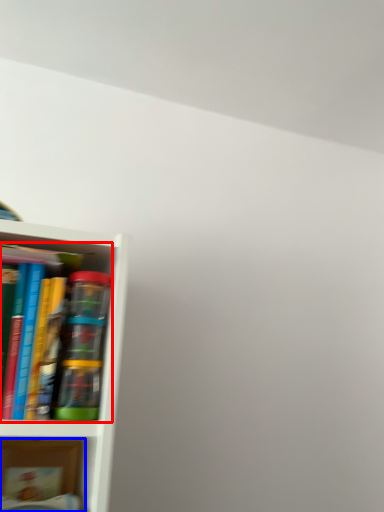
Question: Which object is further to the camera taking this photo, book (highlighted by a red box) or book (highlighted by a blue box)?

Choices:
 (A) book
 (B) book

Answer: (B)